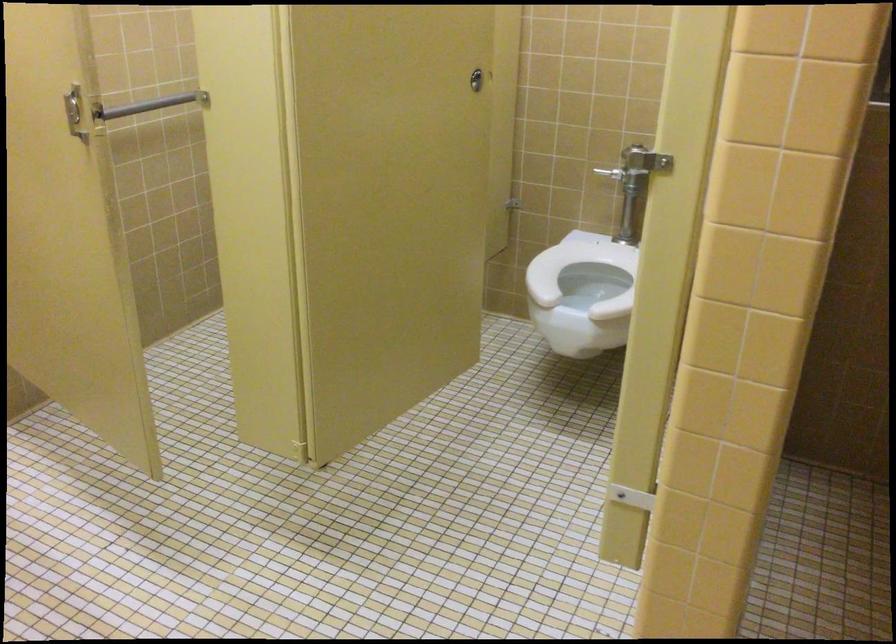
Find where to pull the metal grab bar. Please return your answer as a coordinate pair (x, y).

(150, 105)